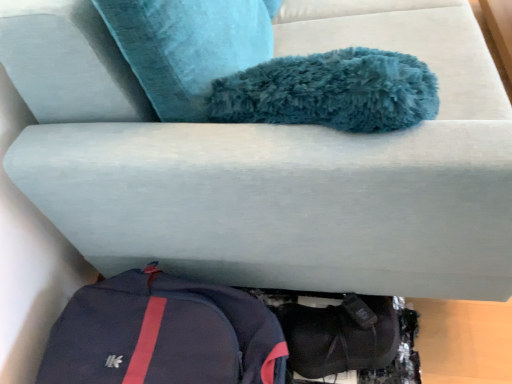
Question: Considering their positions, is navy blue fabric backpack at lower left located in front of or behind black fabric shoe at lower center?

Choices:
 (A) behind
 (B) front

Answer: (B)

Question: From a real-world perspective, is navy blue fabric backpack at lower left physically located above or below black fabric shoe at lower center?

Choices:
 (A) above
 (B) below

Answer: (A)

Question: Considering the positions of navy blue fabric backpack at lower left and black fabric shoe at lower center in the image, is navy blue fabric backpack at lower left wider or thinner than black fabric shoe at lower center?

Choices:
 (A) thin
 (B) wide

Answer: (B)

Question: Is black fabric shoe at lower center spatially inside navy blue fabric backpack at lower left, or outside of it?

Choices:
 (A) outside
 (B) inside

Answer: (A)

Question: In terms of width, does black fabric shoe at lower center look wider or thinner when compared to navy blue fabric backpack at lower left?

Choices:
 (A) wide
 (B) thin

Answer: (B)

Question: Visually, is black fabric shoe at lower center positioned to the left or to the right of navy blue fabric backpack at lower left?

Choices:
 (A) right
 (B) left

Answer: (A)

Question: Looking at the image, does black fabric shoe at lower center seem bigger or smaller compared to navy blue fabric backpack at lower left?

Choices:
 (A) small
 (B) big

Answer: (A)